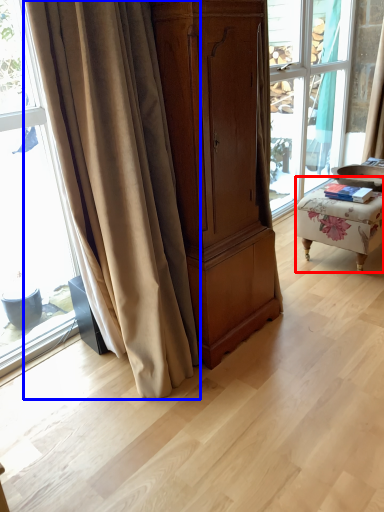
Question: Which point is further to the camera, furniture (highlighted by a red box) or curtain (highlighted by a blue box)?

Choices:
 (A) furniture
 (B) curtain

Answer: (A)